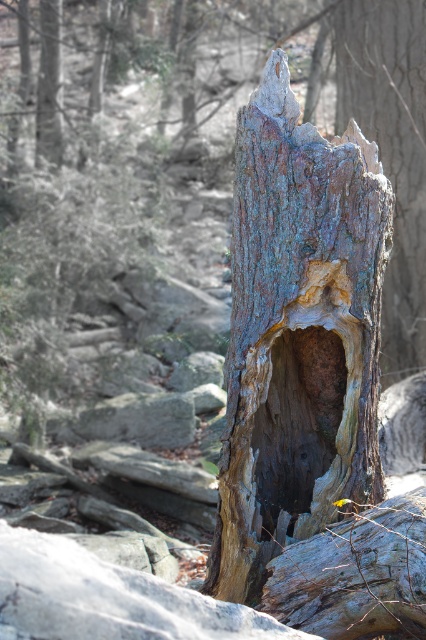
Question: Is rusty wood tree trunk at center closer to camera compared to dark wood hole at center?

Choices:
 (A) yes
 (B) no

Answer: (A)

Question: Which object is closer to the camera taking this photo?

Choices:
 (A) dark wood hole at center
 (B) rusty wood tree trunk at center

Answer: (B)

Question: In this image, where is rusty wood tree trunk at center located relative to dark wood hole at center?

Choices:
 (A) above
 (B) below

Answer: (A)

Question: Is rusty wood tree trunk at center behind dark wood hole at center?

Choices:
 (A) yes
 (B) no

Answer: (B)

Question: Among these points, which one is nearest to the camera?

Choices:
 (A) (328, 369)
 (B) (264, 371)

Answer: (B)